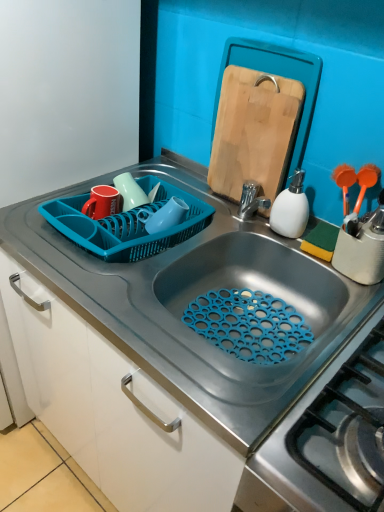
You are a GUI agent. You are given a task and a screenshot of the screen. Output one action in this format:
    pyautogui.click(x=<x>, y=<y>)
    Task: Click on the free spot to the right of matte red mug at upper left, the 2th tableware positioned from the right
    This screenshot has width=384, height=512.
    Given the screenshot: What is the action you would take?
    pyautogui.click(x=181, y=219)